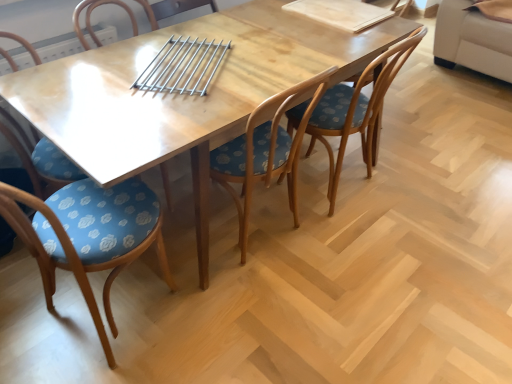
Locate an element on the screen. vacant area that is situated to the right of blue fabric chair at center, positioned as the 3th chair in right-to-left order is located at coordinates (217, 316).